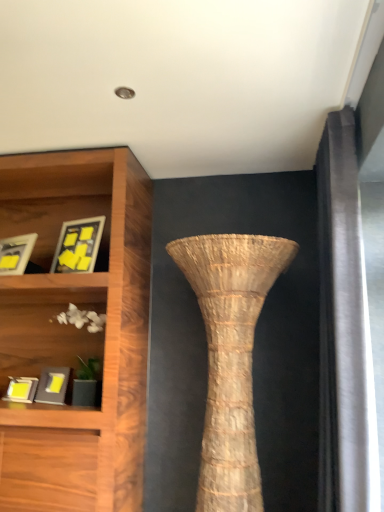
Question: Is matte black picture frame at lower left, placed as the second picture frame when sorted from bottom to top, taller or shorter than matte yellow picture frame at left, which is the 3th picture frame from bottom to top?

Choices:
 (A) short
 (B) tall

Answer: (A)

Question: Is matte black picture frame at lower left, the third picture frame viewed from the top, to the left or to the right of matte yellow picture frame at left, positioned as the 2th picture frame in top-to-bottom order, in the image?

Choices:
 (A) left
 (B) right

Answer: (B)

Question: Which of these objects is positioned closest to the matte wooden picture frame at upper left, the first picture frame when ordered from top to bottom?

Choices:
 (A) natural woven vase at center
 (B) matte black picture frame at lower left, the 4th picture frame when ordered from top to bottom
 (C) matte black picture frame at lower left, placed as the second picture frame when sorted from bottom to top
 (D) white matte shells at lower left
 (E) matte yellow picture frame at left, positioned as the 2th picture frame in top-to-bottom order

Answer: (E)

Question: Estimate the real-world distances between objects in this image. Which object is farther from the matte black picture frame at lower left, placed as the second picture frame when sorted from bottom to top?

Choices:
 (A) natural woven vase at center
 (B) matte wooden picture frame at upper left, the first picture frame when ordered from top to bottom
 (C) white matte shells at lower left
 (D) matte black picture frame at lower left, the 1th picture frame from the bottom
 (E) matte yellow picture frame at left, positioned as the 2th picture frame in top-to-bottom order

Answer: (A)